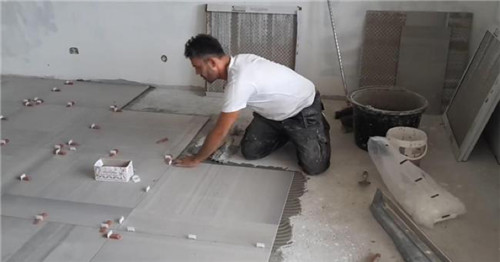
The height and width of the screenshot is (262, 500). What are the coordinates of `tile` in the screenshot? It's located at (186, 193).